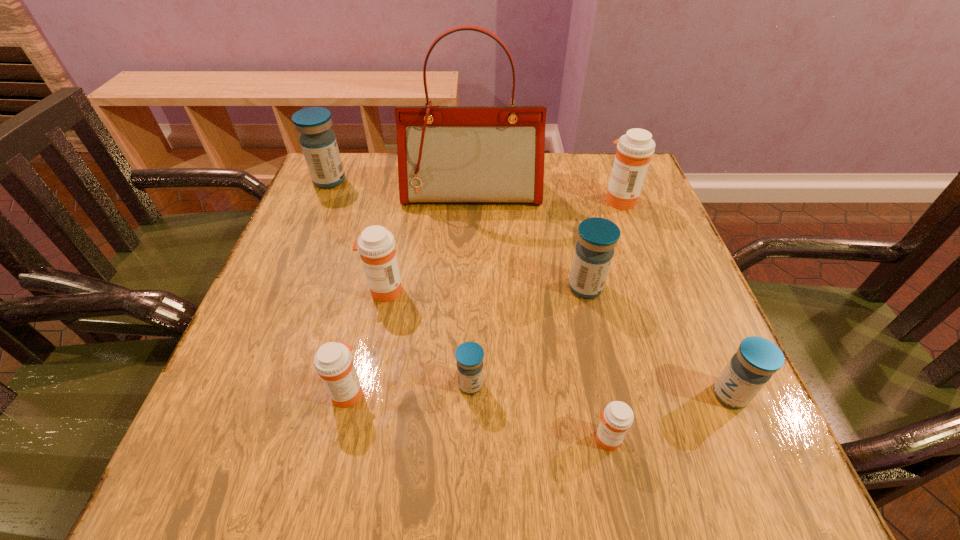
Find the location of `the third biggest blue medicine`. the third biggest blue medicine is located at coordinates (751, 367).

At what (x,y) coordinates should I click in order to perform the action: click on the nearest object. Please return your answer as a coordinate pair (x, y). Looking at the image, I should click on (617, 418).

I want to click on the nearest orange medicine, so click(617, 418).

This screenshot has width=960, height=540. Identify the location of the smallest blue medicine. (469, 355).

This screenshot has height=540, width=960. I want to click on the fifth medicine from right to left, so click(x=469, y=355).

Where is `vacant space located 0.230m on the left of the pink handbag`? The height and width of the screenshot is (540, 960). vacant space located 0.230m on the left of the pink handbag is located at coordinates (312, 194).

Where is `free space located on the front of the biggest blue medicine`? This screenshot has height=540, width=960. free space located on the front of the biggest blue medicine is located at coordinates (279, 300).

Find the location of a particular element. The width and height of the screenshot is (960, 540). blank space located 0.140m on the front of the biggest orange medicine is located at coordinates (638, 251).

This screenshot has width=960, height=540. I want to click on vacant area situated 0.120m on the right of the third nearest orange medicine, so click(x=463, y=291).

Locate an element on the screen. vacant area located 0.130m on the front of the second farthest blue medicine is located at coordinates (601, 357).